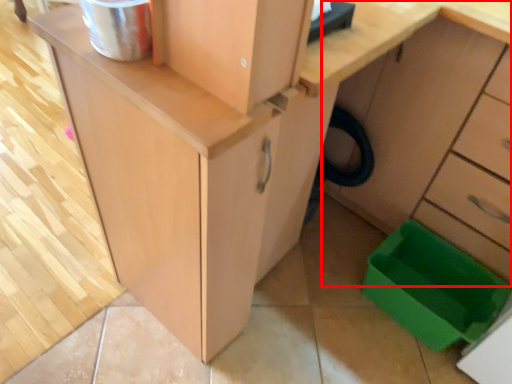
Question: From the image's perspective, where is cabinetry (annotated by the red box) located relative to storage box?

Choices:
 (A) above
 (B) below

Answer: (A)